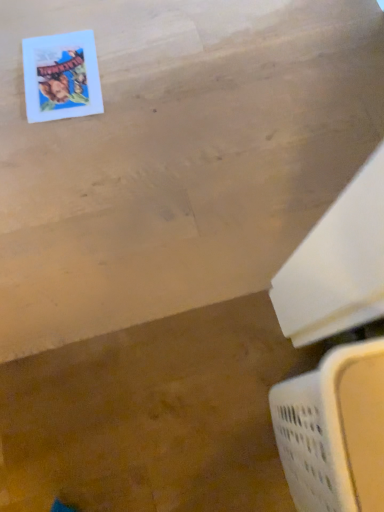
This screenshot has width=384, height=512. In order to click on free location in front of matte paper comic book at upper left in this screenshot , I will do `click(63, 149)`.